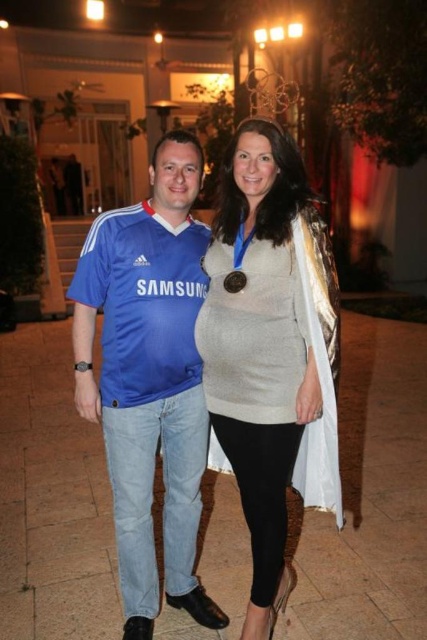
You are planning to take a photo of the blue jersey at center and the gold metallic medal at center. Which object should you focus on first if you want to capture both clearly in the same frame?

The blue jersey at center is larger in size than the gold metallic medal at center, so you should focus on the blue jersey at center first to ensure both objects are in focus.

You are a photographer trying to capture a clear photo of both the blue jersey at center and the matte gray sweater at center. Since the scene is lit by artificial light, you need to adjust your camera settings. Considering their positions, which subject might require more exposure compensation to avoid appearing too dark?

The matte gray sweater at center is behind the blue jersey at center, so it might require more exposure compensation to avoid appearing too dark because it is farther from the camera and possibly in shadow.